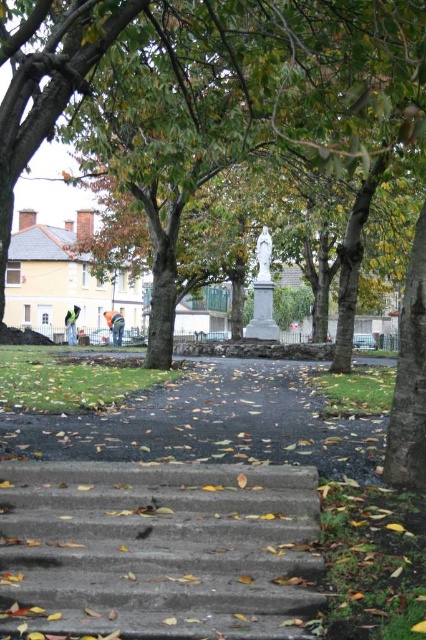
Question: Which point is farther from the camera taking this photo?

Choices:
 (A) (97, 4)
 (B) (310, 477)

Answer: (A)

Question: Is brown leafy tree at center to the left of concrete stairs at lower center from the viewer's perspective?

Choices:
 (A) yes
 (B) no

Answer: (B)

Question: Which point is farther from the camera taking this photo?

Choices:
 (A) (414, 129)
 (B) (296, 499)

Answer: (B)

Question: Is brown leafy tree at center to the right of concrete stairs at lower center from the viewer's perspective?

Choices:
 (A) no
 (B) yes

Answer: (B)

Question: Does brown leafy tree at center have a larger size compared to concrete stairs at lower center?

Choices:
 (A) yes
 (B) no

Answer: (A)